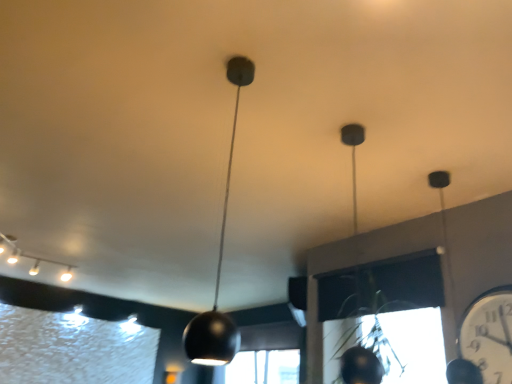
Question: From the image's perspective, does white glossy clock at right appear lower than matte black pendant light at center, the 1th lamp positioned from the front?

Choices:
 (A) no
 (B) yes

Answer: (B)

Question: From the image's perspective, would you say white glossy clock at right is positioned over matte black pendant light at center, the 1th lamp positioned from the front?

Choices:
 (A) yes
 (B) no

Answer: (B)

Question: Are white glossy clock at right and matte black pendant light at center, marked as the second lamp in a back-to-front arrangement, making contact?

Choices:
 (A) yes
 (B) no

Answer: (B)

Question: Is white glossy clock at right not within matte black pendant light at center, the second lamp positioned from the left?

Choices:
 (A) yes
 (B) no

Answer: (A)

Question: Is white glossy clock at right behind matte black pendant light at center, which is the first lamp from right to left?

Choices:
 (A) no
 (B) yes

Answer: (B)

Question: Based on their sizes in the image, would you say matte black pendant light at center, which is the first lamp from right to left, is bigger or smaller than white glossy clock at right?

Choices:
 (A) small
 (B) big

Answer: (B)

Question: From the image's perspective, is matte black pendant light at center, marked as the second lamp in a back-to-front arrangement, positioned above or below white glossy clock at right?

Choices:
 (A) below
 (B) above

Answer: (B)

Question: Is matte black pendant light at center, marked as the second lamp in a back-to-front arrangement, in front of or behind white glossy clock at right in the image?

Choices:
 (A) behind
 (B) front

Answer: (B)

Question: Is point (227, 337) closer or farther from the camera than point (480, 302)?

Choices:
 (A) closer
 (B) farther

Answer: (A)

Question: Is white glossy clock at right inside the boundaries of white glossy track lights at upper left, marked as the second lamp in a right-to-left arrangement, or outside?

Choices:
 (A) outside
 (B) inside

Answer: (A)

Question: Based on their sizes in the image, would you say white glossy clock at right is bigger or smaller than white glossy track lights at upper left, the 2th lamp viewed from the front?

Choices:
 (A) big
 (B) small

Answer: (B)

Question: Would you say white glossy clock at right is to the left or to the right of white glossy track lights at upper left, the 2th lamp viewed from the front, in the picture?

Choices:
 (A) left
 (B) right

Answer: (B)

Question: In terms of height, does white glossy clock at right look taller or shorter compared to white glossy track lights at upper left, the 2th lamp viewed from the front?

Choices:
 (A) short
 (B) tall

Answer: (B)

Question: Do you think matte black pendant light at center, the 1th lamp positioned from the front, is within white glossy track lights at upper left, positioned as the 1th lamp in back-to-front order, or outside of it?

Choices:
 (A) inside
 (B) outside

Answer: (B)

Question: Considering their positions, is matte black pendant light at center, marked as the second lamp in a back-to-front arrangement, located in front of or behind white glossy track lights at upper left, positioned as the 1th lamp in back-to-front order?

Choices:
 (A) behind
 (B) front

Answer: (B)